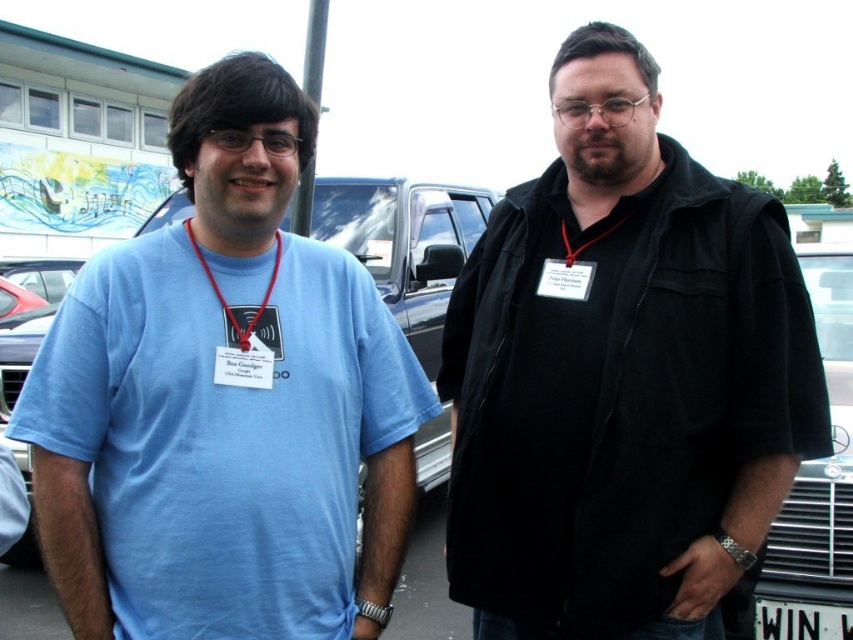
Between matte blue shirt at center and red fabric lanyard at center, which one appears on the right side from the viewer's perspective?

From the viewer's perspective, red fabric lanyard at center appears more on the right side.

Is matte blue shirt at center taller than red fabric lanyard at center?

In fact, matte blue shirt at center may be shorter than red fabric lanyard at center.

Where is `matte blue shirt at center`? The image size is (853, 640). matte blue shirt at center is located at coordinates [x=236, y=225].

Locate an element on the screen. matte blue shirt at center is located at coordinates (236, 225).

Consider the image. Who is lower down, matte blue t-shirt at left or red fabric lanyard at center?

Positioned lower is matte blue t-shirt at left.

Describe the element at coordinates (222, 442) in the screenshot. I see `matte blue t-shirt at left` at that location.

Which is behind, point (231, 417) or point (589, 244)?

The point (589, 244) is more distant.

At what (x,y) coordinates should I click in order to perform the action: click on matte blue t-shirt at left. Please return your answer as a coordinate pair (x, y). This screenshot has height=640, width=853. Looking at the image, I should click on (222, 442).

Is black fabric at center positioned before white plastic license plate at lower right?

That is True.

Does point (604, 211) come farther from viewer compared to point (753, 616)?

No, (604, 211) is closer to viewer.

Where is `black fabric at center`? This screenshot has width=853, height=640. black fabric at center is located at coordinates (607, 164).